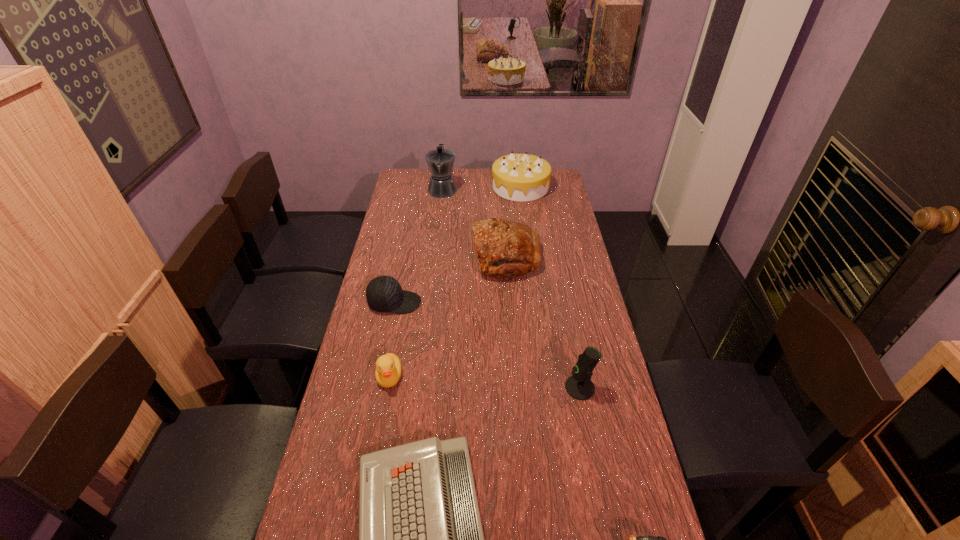
In order to click on the tallest object in this screenshot , I will do `click(440, 161)`.

Locate an element on the screen. birthday cake is located at coordinates (517, 177).

At what (x,y) coordinates should I click in order to perform the action: click on microphone. Please return your answer as a coordinate pair (x, y). The width and height of the screenshot is (960, 540). Looking at the image, I should click on (579, 386).

Locate an element on the screen. Image resolution: width=960 pixels, height=540 pixels. bread is located at coordinates (505, 249).

The image size is (960, 540). Identify the location of baseball cap. pos(384,294).

Find the location of `duck`. duck is located at coordinates (388, 367).

Locate an element on the screen. free space located 0.400m at the spout of the tallest object is located at coordinates (435, 252).

You are a GUI agent. You are given a task and a screenshot of the screen. Output one action in this format:
    pyautogui.click(x=<x>, y=<y>)
    Task: Click on the free space located on the front of the birthday cake
    
    Given the screenshot: What is the action you would take?
    pyautogui.click(x=525, y=227)

Where is `vacant area situated on the left of the microphone`? This screenshot has height=540, width=960. vacant area situated on the left of the microphone is located at coordinates (471, 388).

Find the location of a particular element. The image size is (960, 540). vacant area situated 0.220m at the sliced front of the third farthest object is located at coordinates (420, 257).